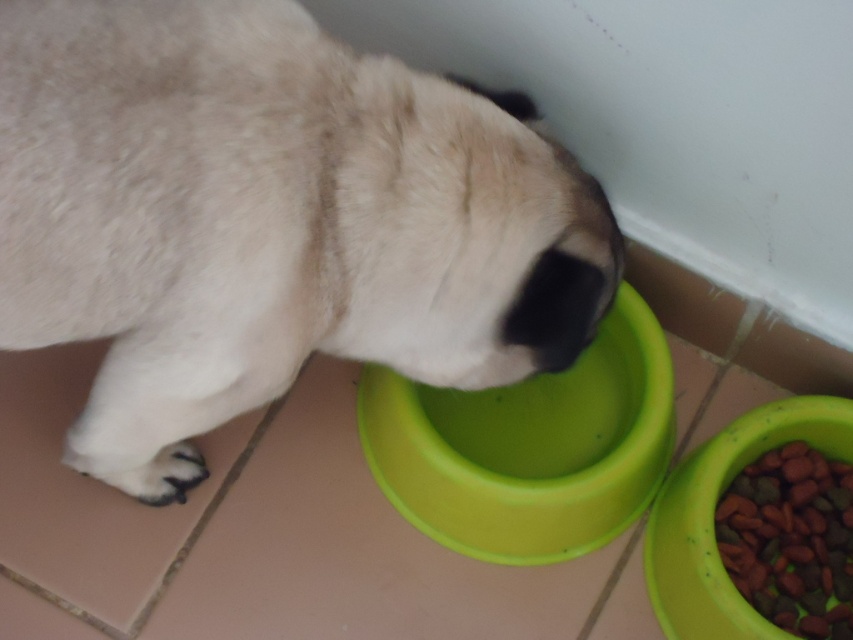
Is white fur dog at center further to the viewer compared to green plastic bowl at center?

No, white fur dog at center is closer to the viewer.

Is point (213, 237) positioned in front of point (579, 467)?

Yes, it is in front of point (579, 467).

Find the location of `white fur dog at center`. white fur dog at center is located at coordinates (268, 220).

Can you confirm if green plastic bowl at center is positioned to the left of brown crunchy kibble at lower right?

Answer: Indeed, green plastic bowl at center is positioned on the left side of brown crunchy kibble at lower right.

Can you confirm if green plastic bowl at center is taller than brown crunchy kibble at lower right?

Correct, green plastic bowl at center is much taller as brown crunchy kibble at lower right.

Image resolution: width=853 pixels, height=640 pixels. I want to click on green plastic bowl at center, so click(529, 445).

Is point (399, 228) farther from viewer compared to point (718, 545)?

No, it is in front of (718, 545).

Who is more forward, (447, 214) or (804, 492)?

Positioned in front is point (447, 214).

Measure the distance between point (26, 209) and camera.

Point (26, 209) is 31.97 inches from camera.

The height and width of the screenshot is (640, 853). I want to click on white fur dog at center, so click(x=268, y=220).